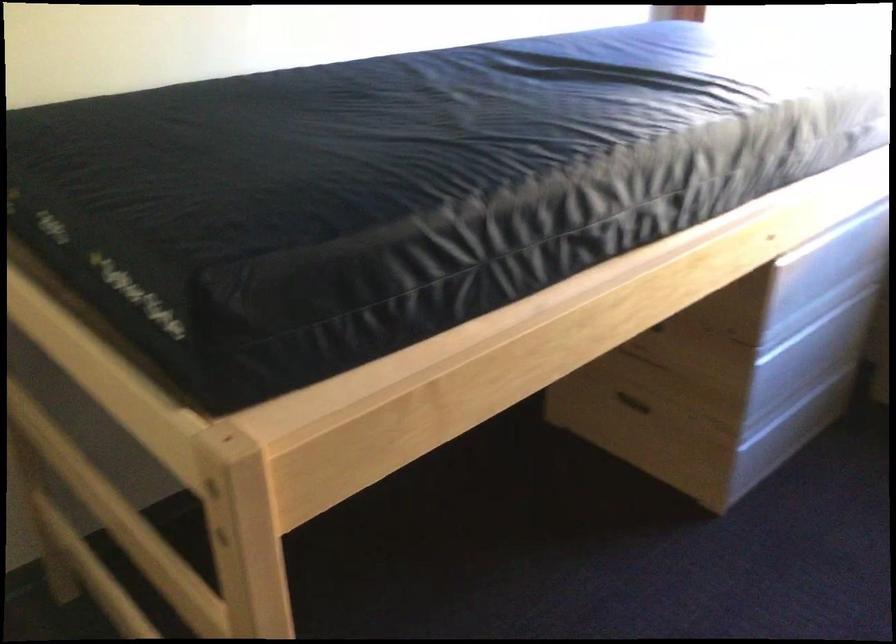
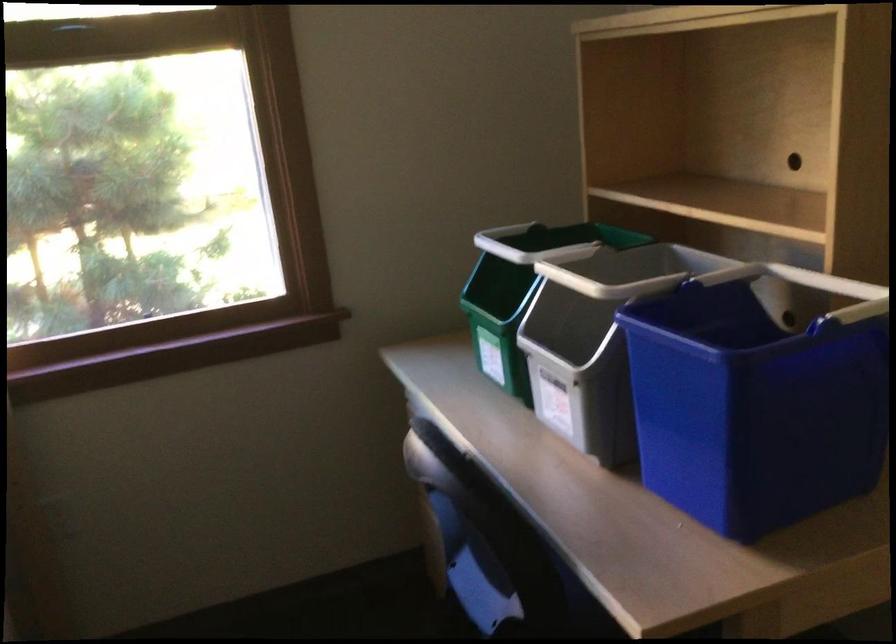
Question: How did the camera likely rotate?

Choices:
 (A) Left
 (B) Right
 (C) Up
 (D) Down

Answer: (B)